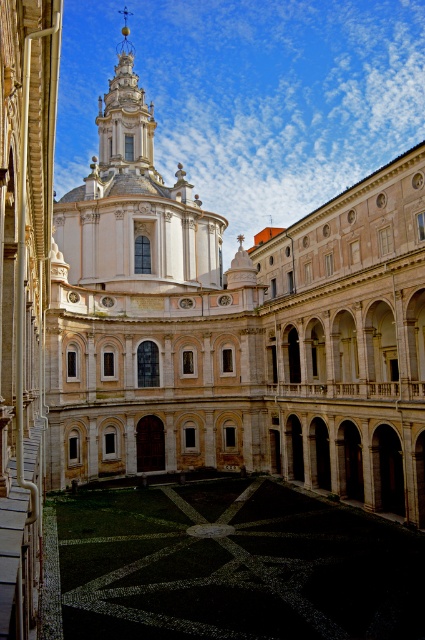
Looking at this image, you are an architect evaluating the proportions of the white marble church at center and the black mosaic courtyard at center in the image. Which structure has a greater vertical dimension?

The white marble church at center is taller than the black mosaic courtyard at center, so it has a greater vertical dimension.